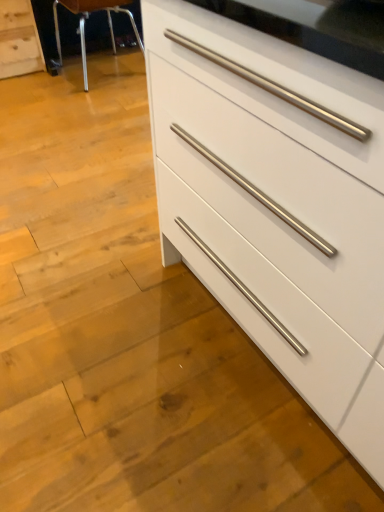
Question: From a real-world perspective, is white matte chest of drawers at lower left, the 2th chest of drawers viewed from the front, over metallic silver bar stool at upper left?

Choices:
 (A) yes
 (B) no

Answer: (B)

Question: Is white matte chest of drawers at lower left, arranged as the 1th chest of drawers when viewed from the left, located outside metallic silver bar stool at upper left?

Choices:
 (A) yes
 (B) no

Answer: (A)

Question: Does white matte chest of drawers at lower left, which is the second chest of drawers in right-to-left order, lie behind metallic silver bar stool at upper left?

Choices:
 (A) no
 (B) yes

Answer: (B)

Question: Can you confirm if white matte chest of drawers at lower left, which ranks as the second chest of drawers in bottom-to-top order, is shorter than metallic silver bar stool at upper left?

Choices:
 (A) no
 (B) yes

Answer: (B)

Question: Is white matte chest of drawers at lower left, which ranks as the first chest of drawers in back-to-front order, bigger than metallic silver bar stool at upper left?

Choices:
 (A) no
 (B) yes

Answer: (A)

Question: Considering the positions of white matte chest of drawers at lower left, arranged as the 1th chest of drawers when viewed from the left, and metallic silver bar stool at upper left in the image, is white matte chest of drawers at lower left, arranged as the 1th chest of drawers when viewed from the left, taller or shorter than metallic silver bar stool at upper left?

Choices:
 (A) short
 (B) tall

Answer: (A)

Question: Considering the positions of white matte chest of drawers at lower left, which ranks as the first chest of drawers in back-to-front order, and metallic silver bar stool at upper left in the image, is white matte chest of drawers at lower left, which ranks as the first chest of drawers in back-to-front order, bigger or smaller than metallic silver bar stool at upper left?

Choices:
 (A) big
 (B) small

Answer: (B)

Question: In the image, is white matte chest of drawers at lower left, arranged as the 1th chest of drawers when viewed from the left, on the left side or the right side of metallic silver bar stool at upper left?

Choices:
 (A) right
 (B) left

Answer: (B)

Question: In the image, is white matte chest of drawers at lower left, the 2th chest of drawers viewed from the front, positioned in front of or behind metallic silver bar stool at upper left?

Choices:
 (A) behind
 (B) front

Answer: (A)

Question: Considering the positions of point (311, 77) and point (56, 42), is point (311, 77) closer or farther from the camera than point (56, 42)?

Choices:
 (A) farther
 (B) closer

Answer: (B)

Question: In terms of width, does white glossy chest of drawers at center, the first chest of drawers in the right-to-left sequence, look wider or thinner when compared to metallic silver bar stool at upper left?

Choices:
 (A) thin
 (B) wide

Answer: (B)

Question: Which is correct: white glossy chest of drawers at center, which is the 2th chest of drawers from top to bottom, is inside metallic silver bar stool at upper left, or outside of it?

Choices:
 (A) inside
 (B) outside

Answer: (B)

Question: Considering the positions of white glossy chest of drawers at center, the 2th chest of drawers positioned from the left, and metallic silver bar stool at upper left in the image, is white glossy chest of drawers at center, the 2th chest of drawers positioned from the left, taller or shorter than metallic silver bar stool at upper left?

Choices:
 (A) tall
 (B) short

Answer: (A)

Question: Based on their positions, is white matte chest of drawers at lower left, which ranks as the second chest of drawers in bottom-to-top order, located to the left or right of white glossy chest of drawers at center, the first chest of drawers in the right-to-left sequence?

Choices:
 (A) left
 (B) right

Answer: (A)

Question: Considering their positions, is white matte chest of drawers at lower left, the 2th chest of drawers viewed from the front, located in front of or behind white glossy chest of drawers at center, the 1th chest of drawers from the front?

Choices:
 (A) behind
 (B) front

Answer: (A)